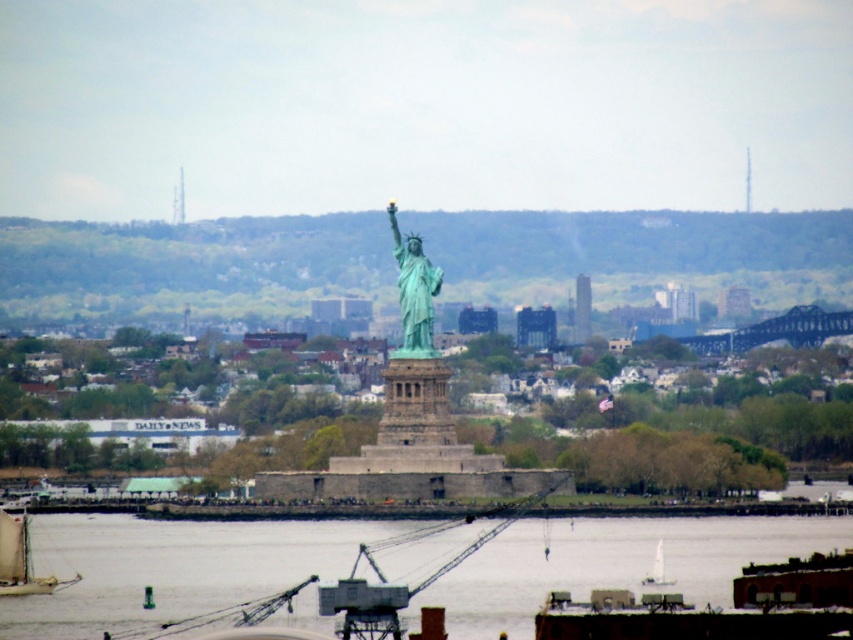
Question: Which of the following is the closest to the observer?

Choices:
 (A) wooden sailboat at lower left
 (B) clear water at lower center

Answer: (B)

Question: Can you confirm if green patina statue at center is positioned below wooden sailboat at lower left?

Choices:
 (A) no
 (B) yes

Answer: (A)

Question: Is clear water at lower center to the right of green patina statue at center from the viewer's perspective?

Choices:
 (A) yes
 (B) no

Answer: (A)

Question: Can you confirm if green patina statue at center is positioned below white plastic boat at lower center?

Choices:
 (A) yes
 (B) no

Answer: (B)

Question: Which point is farther to the camera?

Choices:
 (A) (598, 524)
 (B) (675, 580)
 (C) (426, 348)
 (D) (22, 547)

Answer: (D)

Question: Which object is the farthest from the wooden sailboat at lower left?

Choices:
 (A) white plastic boat at lower center
 (B) clear water at lower center
 (C) green patina statue at center

Answer: (A)